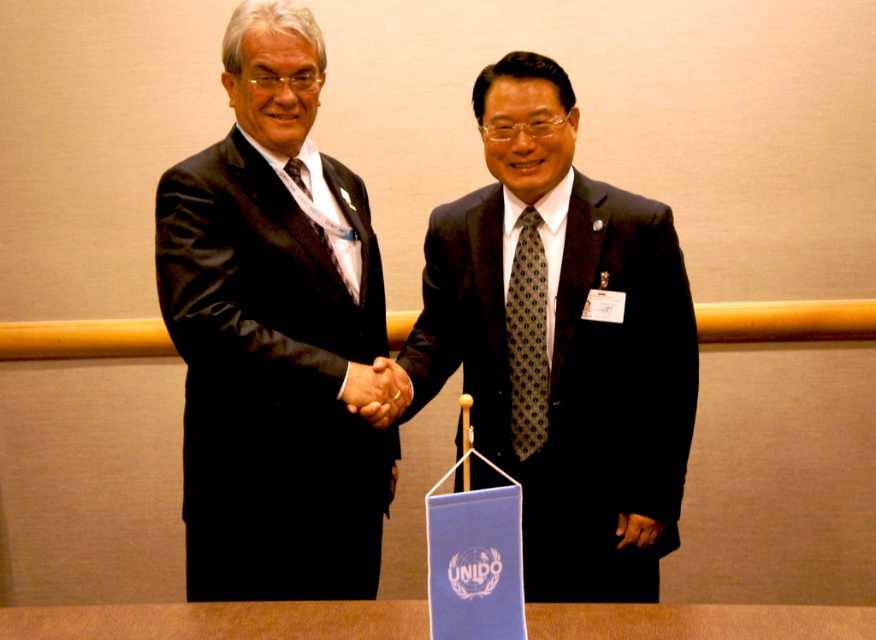
You are standing in front of the two men shaking hands at a UNIDO event. There are two points marked on the floor in front of them. One is at coordinates point [308,396] and the other is at point [399,616]. Which point is closer to you?

Point [308,396] is closer to you because it is further to the viewer than point [399,616].

You are a photographer at the event and need to ensure that both the black satin suit at left and the matte black tie at center are clearly visible in the photo. Given their height difference, which object should you focus on first to ensure proper framing?

The black satin suit at left is taller than the matte black tie at center, so focusing on the black satin suit at left first will ensure proper framing as it occupies more vertical space.